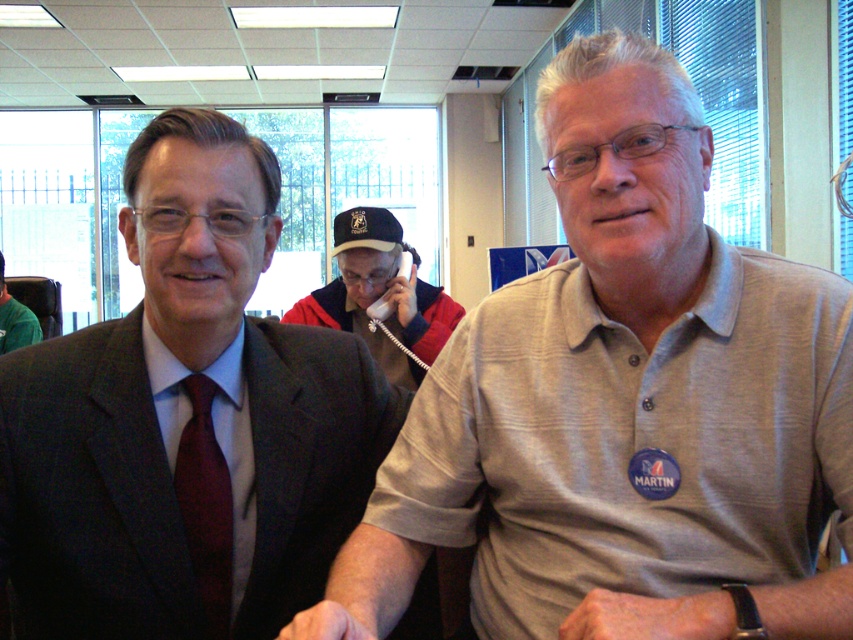
You are standing in an office and need to locate the red jacket at center. According to the coordinates provided, where exactly should you look?

The red jacket at center is located at point coordinates 0.463 on the x axis and 0.445 on the y axis.

You are organizing a charity event and need to hang a 1.2 meter wide banner between the red jacket at center and the matte red tie at left. Can the space between them accommodate the banner?

The red jacket at center is wider than the matte red tie at left, but the exact distance between them isn